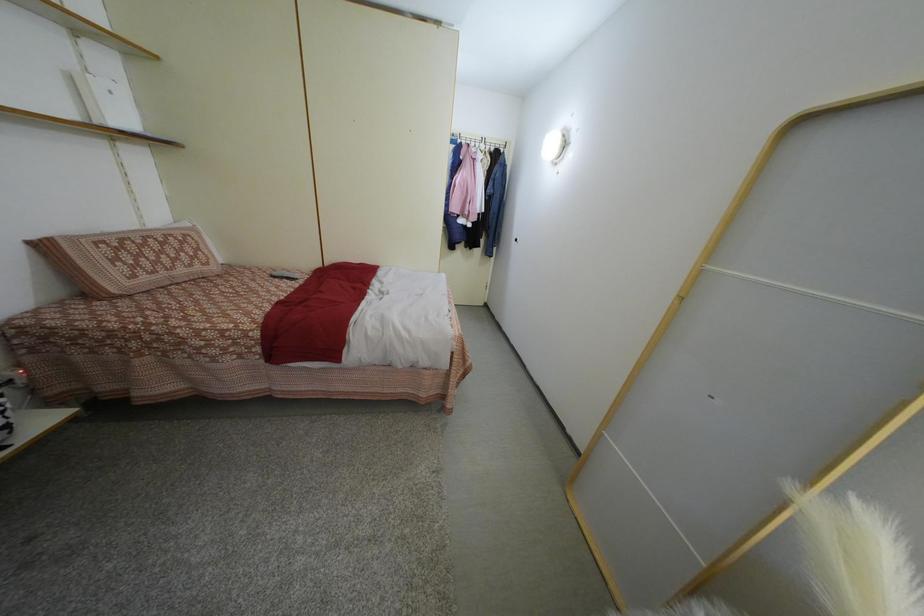
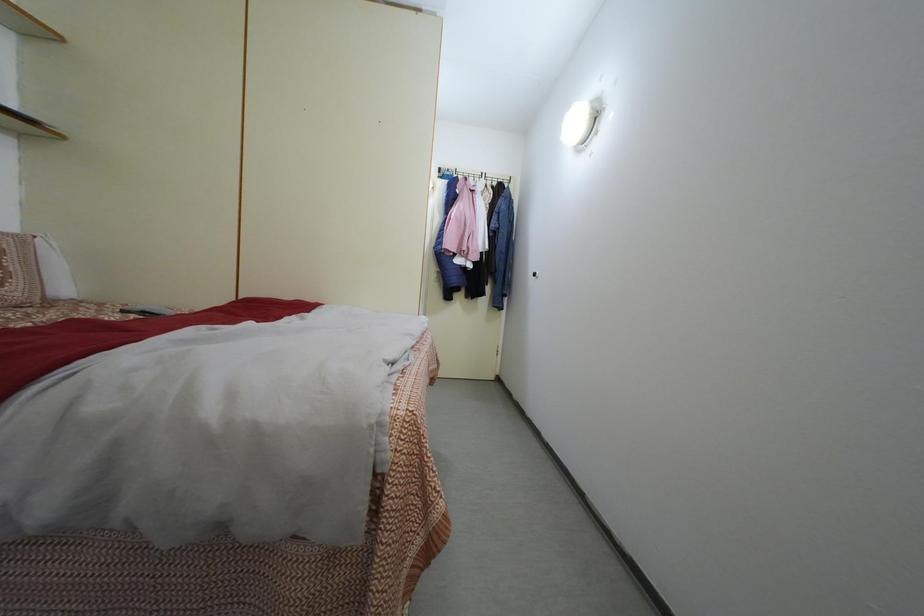
Question: In a continuous first-person perspective shot, in which direction is the camera moving?

Choices:
 (A) Left
 (B) Right
 (C) Forward
 (D) Backward

Answer: (C)